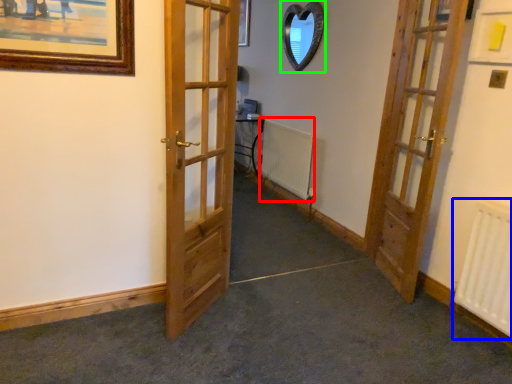
Question: Estimate the real-world distances between objects in this image. Which object is closer to radiator (highlighted by a red box), radiator (highlighted by a blue box) or mirror (highlighted by a green box)?

Choices:
 (A) radiator
 (B) mirror

Answer: (B)